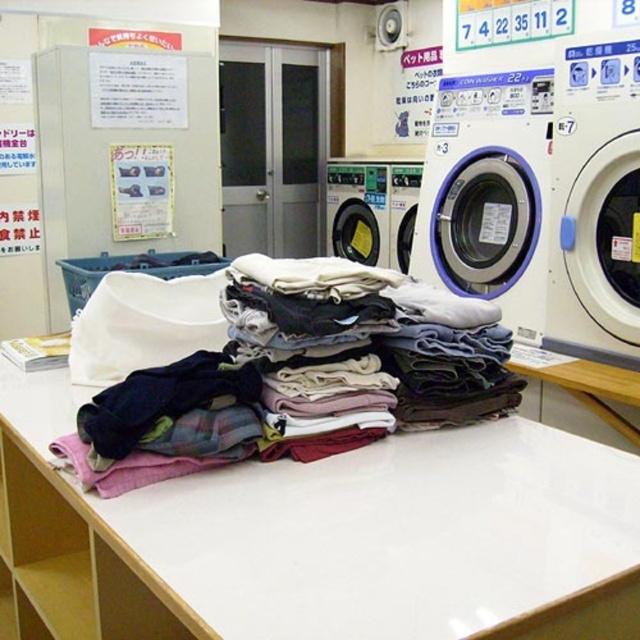
Question: Does white plastic washing machine at center-right have a larger size compared to white plastic washing machine at center?

Choices:
 (A) no
 (B) yes

Answer: (B)

Question: Can you confirm if white plastic washing machine at center-right is thinner than white plastic washing machine at right?

Choices:
 (A) no
 (B) yes

Answer: (A)

Question: Which object is the farthest from the white glossy table at center?

Choices:
 (A) white plastic washing machine at center-right
 (B) white plastic washing machine at right
 (C) multicolored fabric at center

Answer: (A)

Question: Is white plastic washing machine at center-right thinner than white plastic washing machine at center?

Choices:
 (A) no
 (B) yes

Answer: (A)

Question: Which point is farther to the camera?

Choices:
 (A) (403, 250)
 (B) (492, 246)

Answer: (A)

Question: Which object appears farthest from the camera in this image?

Choices:
 (A) multicolored fabric at center
 (B) white plastic washing machine at right
 (C) white plastic washing machine at center-right
 (D) metallic gray washing machine at center

Answer: (D)